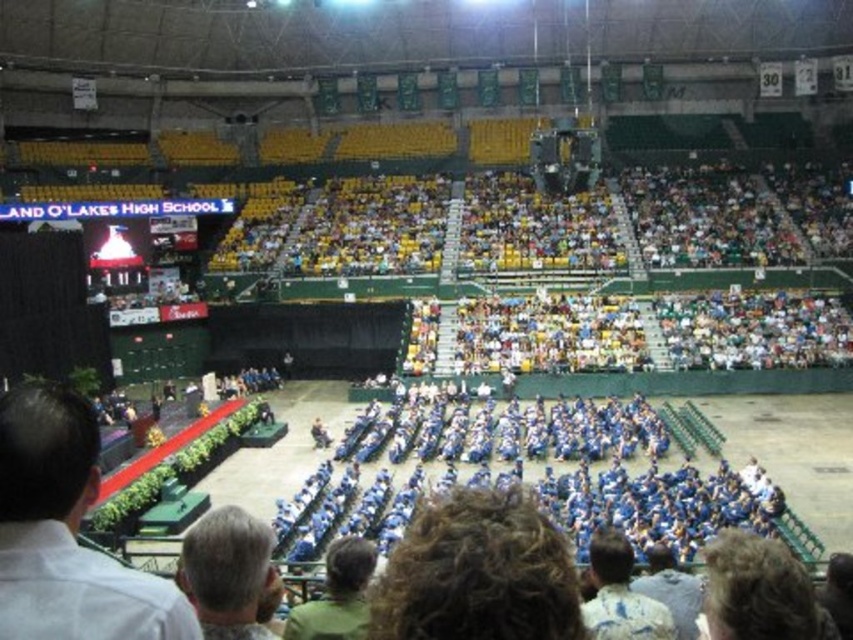
Question: Among these points, which one is nearest to the camera?

Choices:
 (A) (271, 532)
 (B) (83, 620)

Answer: (B)

Question: Does gray hair at lower left have a smaller size compared to green matte shirt at lower center?

Choices:
 (A) yes
 (B) no

Answer: (B)

Question: Where is white shirt at lower left located in relation to dark brown hair at lower right in the image?

Choices:
 (A) below
 (B) above

Answer: (B)

Question: Which point appears farthest from the camera in this image?

Choices:
 (A) [x=612, y=588]
 (B) [x=143, y=602]
 (C) [x=341, y=636]
 (D) [x=459, y=515]

Answer: (A)

Question: Among these objects, which one is nearest to the camera?

Choices:
 (A) gray hair at lower left
 (B) white shirt at lower left

Answer: (B)

Question: Can you confirm if white shirt at lower left is bigger than dark brown hair at lower right?

Choices:
 (A) yes
 (B) no

Answer: (B)